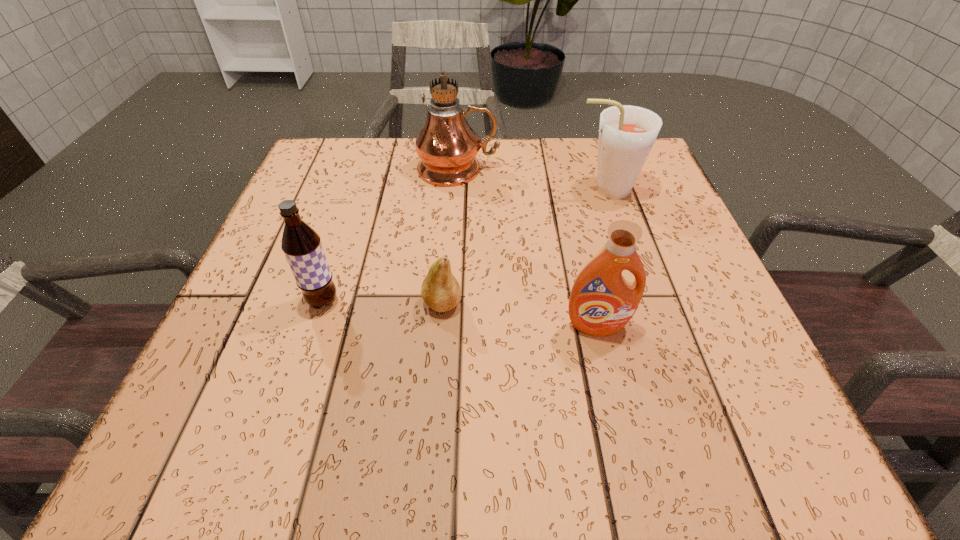
Locate an element on the screen. The height and width of the screenshot is (540, 960). vacant space at the left edge of the desktop is located at coordinates (269, 257).

The width and height of the screenshot is (960, 540). I want to click on blank area at the right edge, so click(x=723, y=382).

Locate an element on the screen. Image resolution: width=960 pixels, height=540 pixels. free spot at the far left corner of the desktop is located at coordinates click(x=307, y=177).

You are a GUI agent. You are given a task and a screenshot of the screen. Output one action in this format:
    pyautogui.click(x=<x>, y=<y>)
    Task: Click on the blank space at the near left corner
    
    Given the screenshot: What is the action you would take?
    pyautogui.click(x=269, y=421)

Locate an element on the screen. This screenshot has width=960, height=540. vacant position at the near right corner of the desktop is located at coordinates (740, 456).

The width and height of the screenshot is (960, 540). Find the location of `vacant space in between the tallest object and the left root beer`. vacant space in between the tallest object and the left root beer is located at coordinates (391, 235).

Where is `vacant region between the nearer root beer and the farther root beer`? The width and height of the screenshot is (960, 540). vacant region between the nearer root beer and the farther root beer is located at coordinates (464, 246).

At what (x,y) coordinates should I click in order to perform the action: click on vacant region between the left root beer and the shortest object. Please return your answer as a coordinate pair (x, y). Image resolution: width=960 pixels, height=540 pixels. Looking at the image, I should click on (382, 302).

Where is `vacant area between the leftmost object and the detergent`? vacant area between the leftmost object and the detergent is located at coordinates (460, 314).

Where is `free space between the leftmost object and the pear`? The height and width of the screenshot is (540, 960). free space between the leftmost object and the pear is located at coordinates point(382,302).